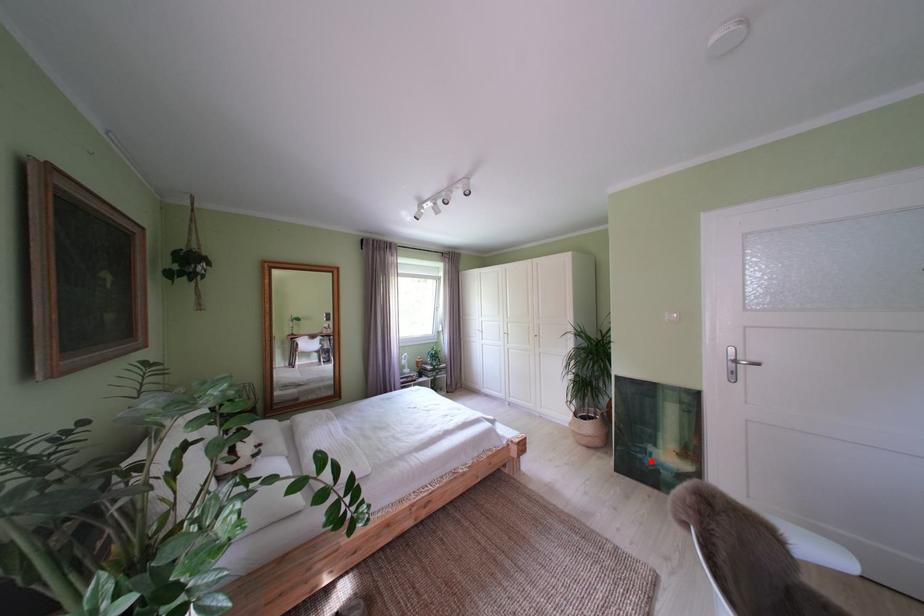
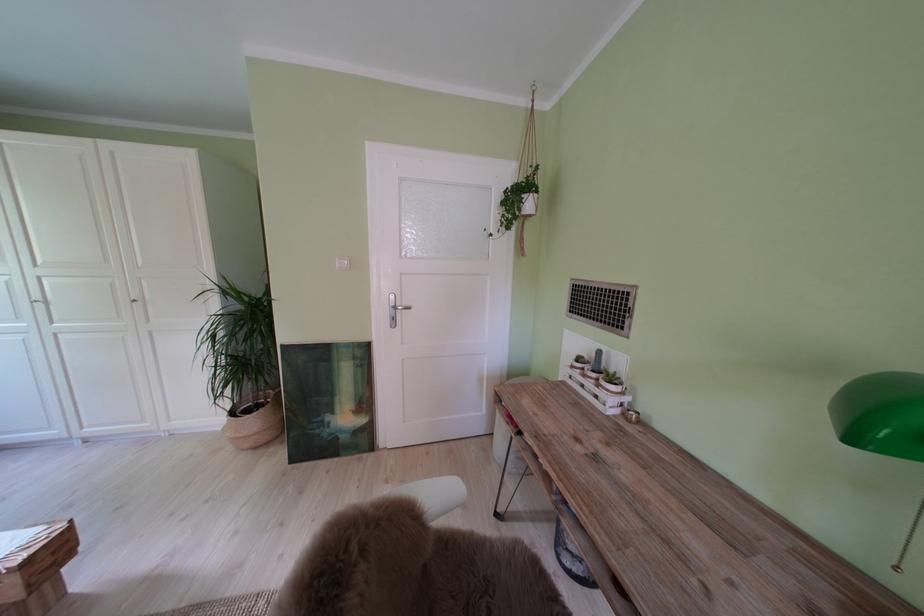
Where in the second image is the point corresponding to the highlighted location from the first image?

(329, 437)